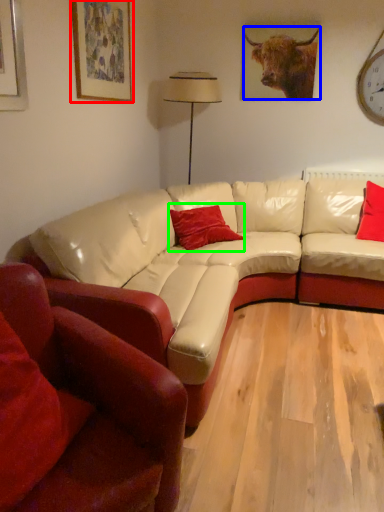
Question: Which is farther away from picture frame (highlighted by a red box)? bull (highlighted by a blue box) or pillow (highlighted by a green box)?

Choices:
 (A) bull
 (B) pillow

Answer: (A)